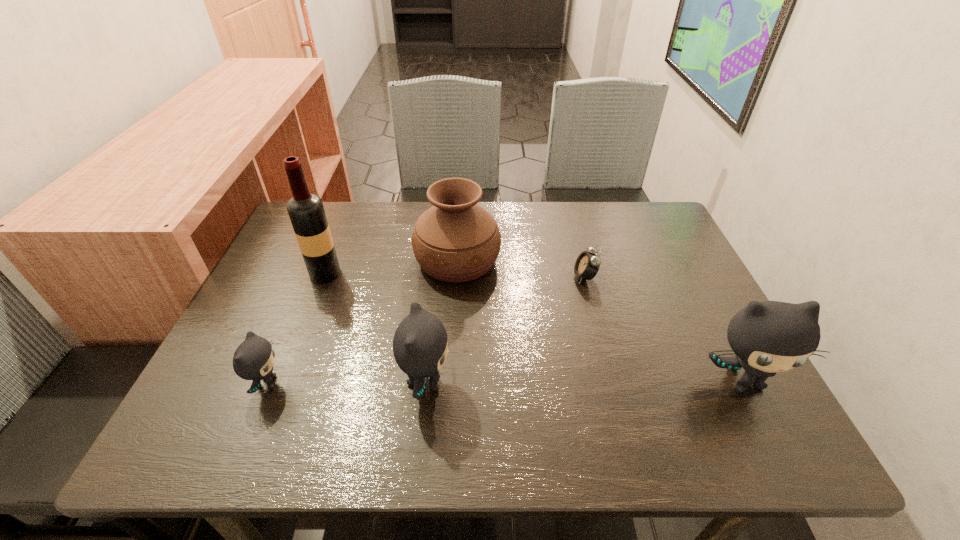
Where is `vacant space located 0.310m on the front-facing side of the fourth tallest object`? vacant space located 0.310m on the front-facing side of the fourth tallest object is located at coordinates (603, 382).

Locate an element on the screen. vacant space located on the right of the wine bottle is located at coordinates (463, 273).

The image size is (960, 540). What are the coordinates of `free region located on the back of the urn` in the screenshot? It's located at (460, 215).

At what (x,y) coordinates should I click in order to perform the action: click on vacant area located 0.190m on the face of the alarm clock. Please return your answer as a coordinate pair (x, y). This screenshot has width=960, height=540. Looking at the image, I should click on (500, 276).

Find the location of a particular element. This screenshot has height=540, width=960. vacant space situated on the face of the alarm clock is located at coordinates (443, 276).

Find the location of a particular element. free space located on the face of the alarm clock is located at coordinates (473, 276).

Locate an element on the screen. The height and width of the screenshot is (540, 960). object that is at the far edge is located at coordinates (456, 240).

I want to click on kitten that is at the left edge, so click(254, 358).

This screenshot has width=960, height=540. In order to click on wine bottle that is at the left edge in this screenshot , I will do `click(306, 211)`.

Where is `object that is at the right edge`? object that is at the right edge is located at coordinates (767, 337).